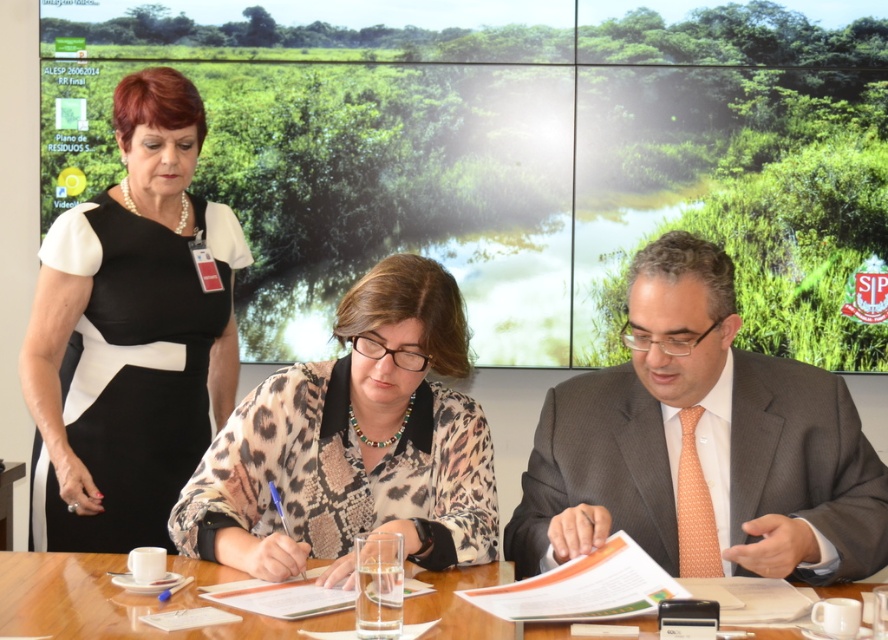
Question: Can you confirm if black satin dress at upper left is wider than wooden table at center?

Choices:
 (A) no
 (B) yes

Answer: (A)

Question: Which object is the farthest from the wooden table at center?

Choices:
 (A) leopard print shirt at center
 (B) black satin dress at upper left
 (C) orange dotted tie at center

Answer: (B)

Question: Which object is positioned closest to the black satin dress at upper left?

Choices:
 (A) leopard print shirt at center
 (B) orange dotted tie at center

Answer: (A)

Question: Estimate the real-world distances between objects in this image. Which object is farther from the leopard print shirt at center?

Choices:
 (A) black satin dress at upper left
 (B) wooden table at center

Answer: (A)

Question: Can you confirm if orange dotted tie at center is bigger than black satin dress at upper left?

Choices:
 (A) yes
 (B) no

Answer: (B)

Question: Is the position of orange dotted tie at center less distant than that of leopard print shirt at center?

Choices:
 (A) yes
 (B) no

Answer: (A)